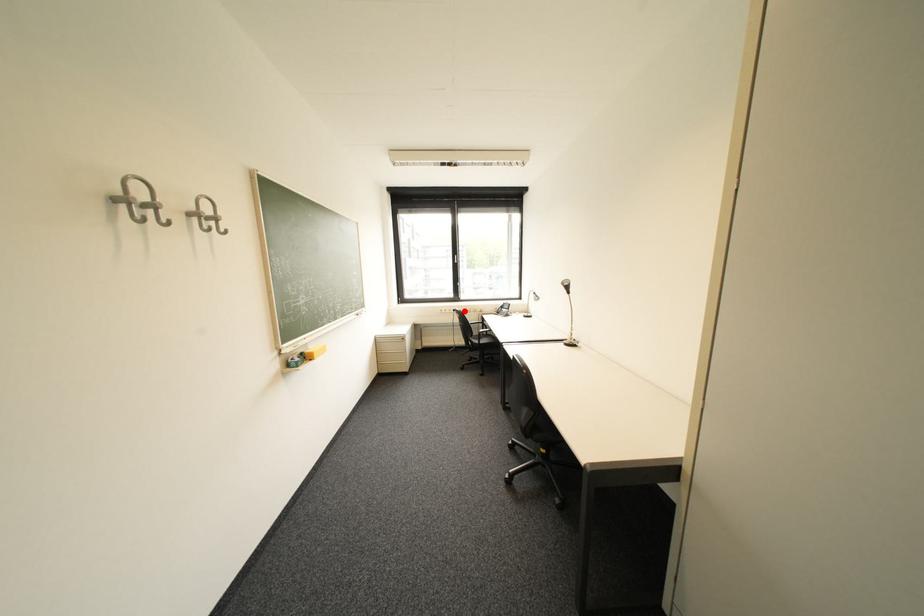
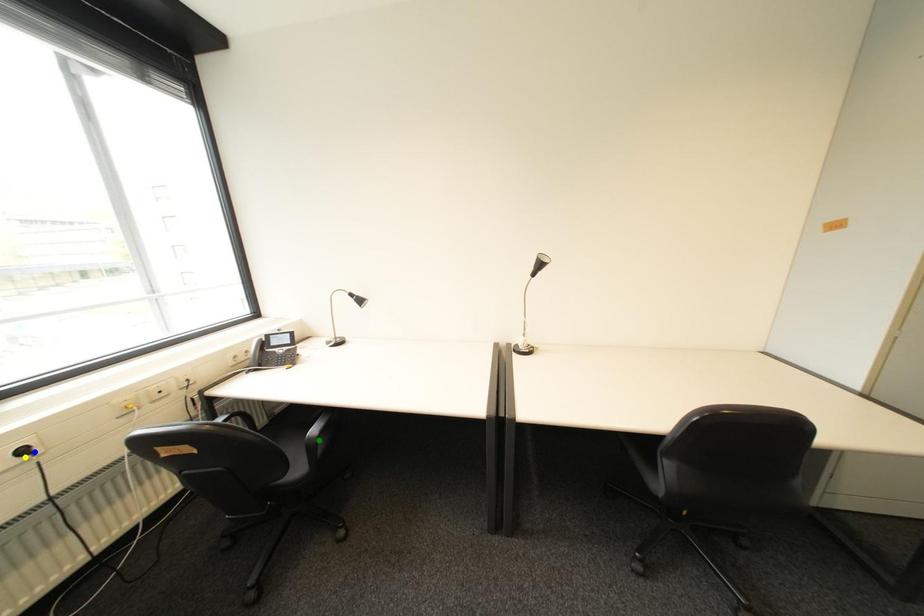
Question: I am providing you with two images of the same scene from different viewpoints. A red point is marked on the first image. You are given multiple points on the second image. Which point in image 2 represents the same 3d spot as the red point in image 1?

Choices:
 (A) green point
 (B) yellow point
 (C) blue point

Answer: (C)